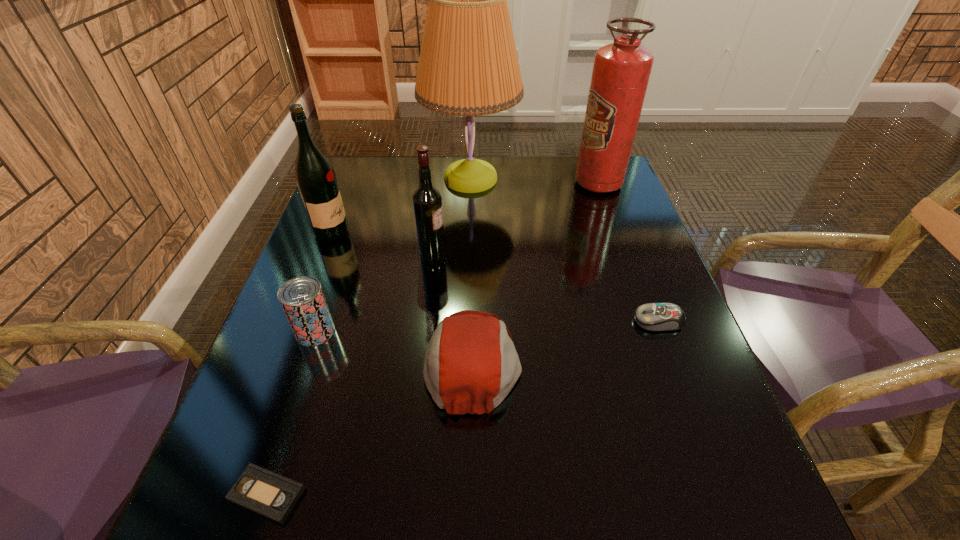
At what (x,y) coordinates should I click in order to perform the action: click on free region located on the side of the lamp near the pull switch. Please return your answer as a coordinate pair (x, y). This screenshot has height=540, width=960. Looking at the image, I should click on (575, 178).

The height and width of the screenshot is (540, 960). Find the location of `vacant position located on the label side of the fire extinguisher`. vacant position located on the label side of the fire extinguisher is located at coordinates (514, 183).

Locate an element on the screen. Image resolution: width=960 pixels, height=540 pixels. vacant space located 0.180m on the label side of the fire extinguisher is located at coordinates (514, 183).

Identify the location of vacant space located 0.400m on the label side of the fire extinguisher. The image size is (960, 540). (440, 183).

Where is `vacant region located on the front-facing side of the third farthest object`? This screenshot has height=540, width=960. vacant region located on the front-facing side of the third farthest object is located at coordinates (465, 233).

You are a GUI agent. You are given a task and a screenshot of the screen. Output one action in this format:
    pyautogui.click(x=<x>, y=<y>)
    Task: Click on the vacant space located 0.300m on the front and back of the fifth nearest object
    The image size is (960, 540).
    Given the screenshot: What is the action you would take?
    pyautogui.click(x=569, y=258)

Find the location of a particular element. free region located on the back of the beer can is located at coordinates (357, 210).

Where is `vacant point located on the front-facing side of the cap`? vacant point located on the front-facing side of the cap is located at coordinates (644, 361).

The height and width of the screenshot is (540, 960). Identify the location of free spot located on the wheel side of the second shortest object. (492, 321).

This screenshot has height=540, width=960. What are the coordinates of `vacant space located on the wheel side of the second shortest object` in the screenshot? It's located at (463, 321).